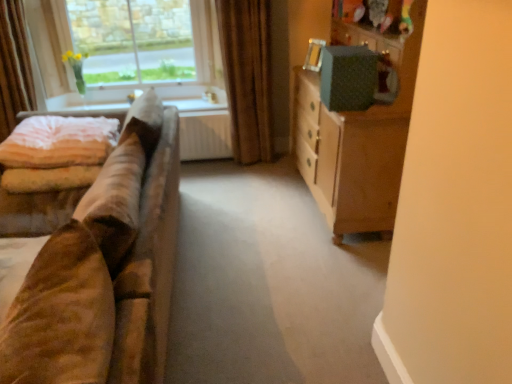
This screenshot has width=512, height=384. Identify the location of free location to the left of green textured cabinet at right. (249, 223).